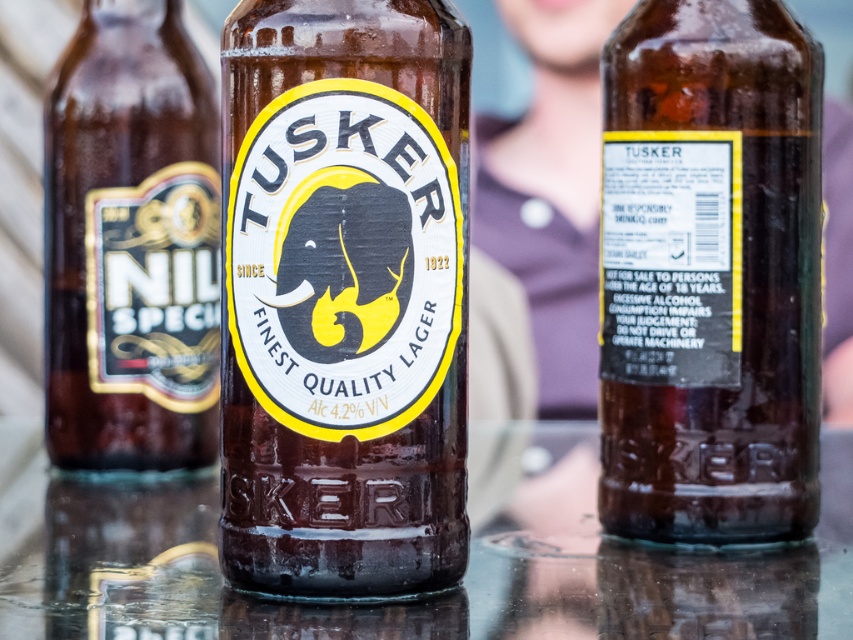
Question: Which of the following is the farthest from the observer?

Choices:
 (A) (329, 364)
 (B) (730, 44)
 (C) (135, 324)

Answer: (C)

Question: Is matte glass tusker lager at center to the right of brown glass bottle at center from the viewer's perspective?

Choices:
 (A) yes
 (B) no

Answer: (B)

Question: Estimate the real-world distances between objects in this image. Which object is closer to the matte gold label at left?

Choices:
 (A) brown glass bottle at center
 (B) matte glass tusker lager at center

Answer: (B)

Question: Which of the following is the farthest from the observer?

Choices:
 (A) matte glass tusker lager at center
 (B) brown glass bottle at center
 (C) matte gold label at left

Answer: (C)

Question: Does brown glass bottle at center come in front of matte gold label at left?

Choices:
 (A) yes
 (B) no

Answer: (A)

Question: Is matte glass tusker lager at center closer to the viewer compared to matte gold label at left?

Choices:
 (A) yes
 (B) no

Answer: (A)